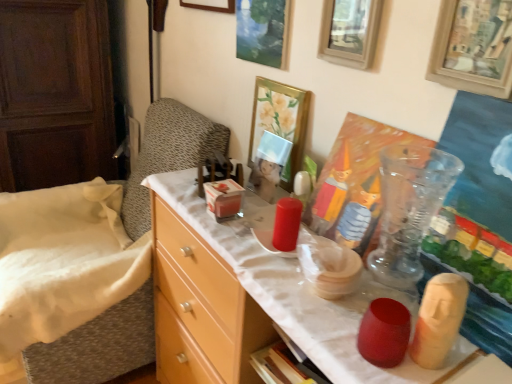
Question: In terms of height, does light wood dresser at left look taller or shorter compared to white fabric bedsheet at left?

Choices:
 (A) tall
 (B) short

Answer: (A)

Question: Which is correct: light wood dresser at left is inside white fabric bedsheet at left, or outside of it?

Choices:
 (A) inside
 (B) outside

Answer: (B)

Question: Estimate the real-world distances between objects in this image. Which object is closer to the matte wood desk at center?

Choices:
 (A) wooden picture frame at upper right, the fifth picture frame positioned from the left
 (B) light wood dresser at left
 (C) white fabric bedsheet at left
 (D) wooden picture frame at upper center, the 4th picture frame from the left
 (E) matte wooden picture frame at upper center, arranged as the fifth picture frame when viewed from the right

Answer: (D)

Question: Based on their relative distances, which object is nearer to the matte wooden picture frame at upper center, the second picture frame when ordered from left to right?

Choices:
 (A) light wood dresser at left
 (B) light wood dresser at left
 (C) matte wooden picture frame at upper center, arranged as the fifth picture frame when viewed from the right
 (D) matte wood desk at center
 (E) wooden picture frame at upper right, arranged as the first picture frame when viewed from the right

Answer: (C)